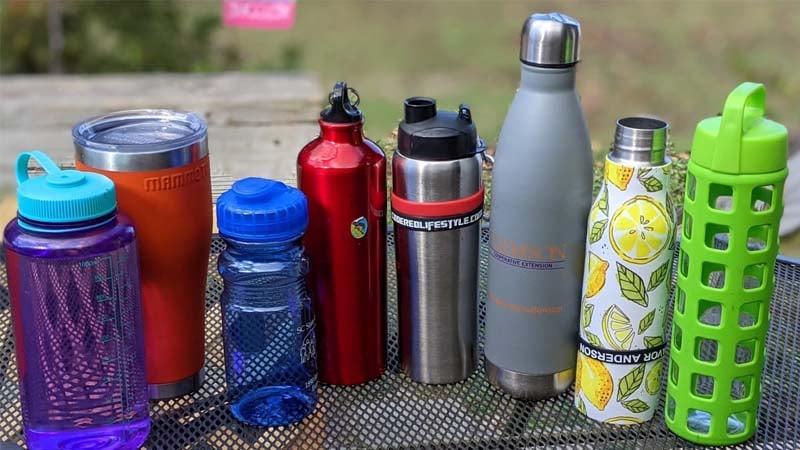
The height and width of the screenshot is (450, 800). I want to click on cup, so click(x=98, y=345), click(x=261, y=341), click(x=340, y=258), click(x=186, y=296), click(x=424, y=258), click(x=540, y=276), click(x=640, y=305), click(x=721, y=301).